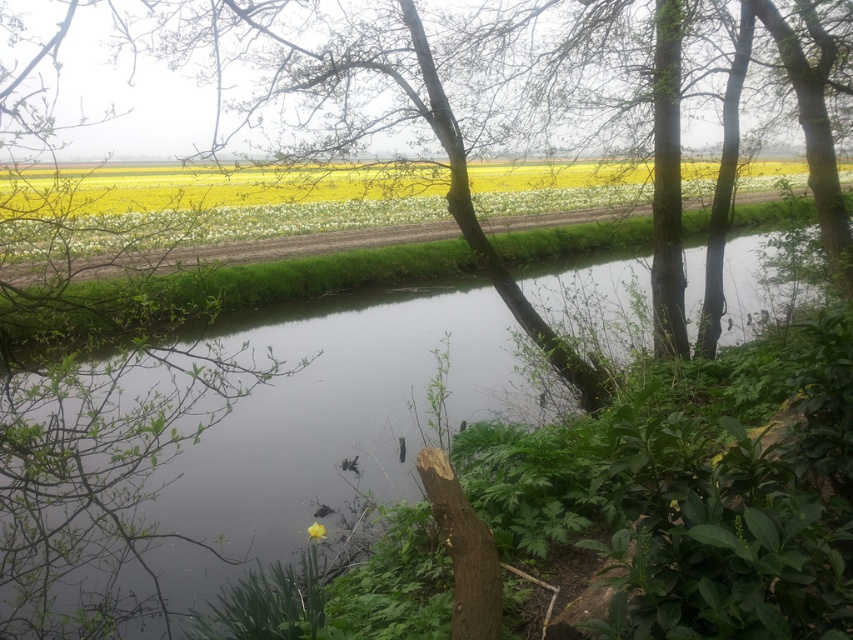
In the serene rural landscape, you see clear water at center and a yellow matte flower at center. Which object is positioned to the right of the other?

The clear water at center is to the right of yellow matte flower at center.

You are standing at the edge of the waterway and notice two yellow matte flowers in the scene. Which one, the yellow matte flowers at upper center or the yellow matte flower at center, is positioned higher up in the image?

The yellow matte flowers at upper center is positioned higher up in the image than the yellow matte flower at center.